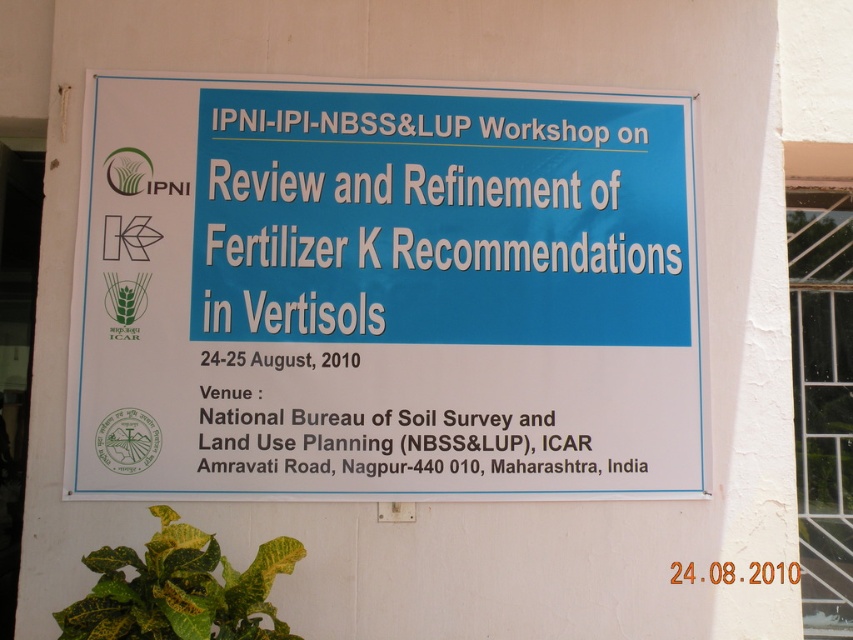
You are standing in front of the signboard and want to touch the point at coordinates point (x=154, y=484). Can you reach it without moving your position?

The distance between point (x=154, y=484) and the camera is 3.00 meters. Since the average human arm length is about 0.7 meters, you cannot reach the point without moving closer.